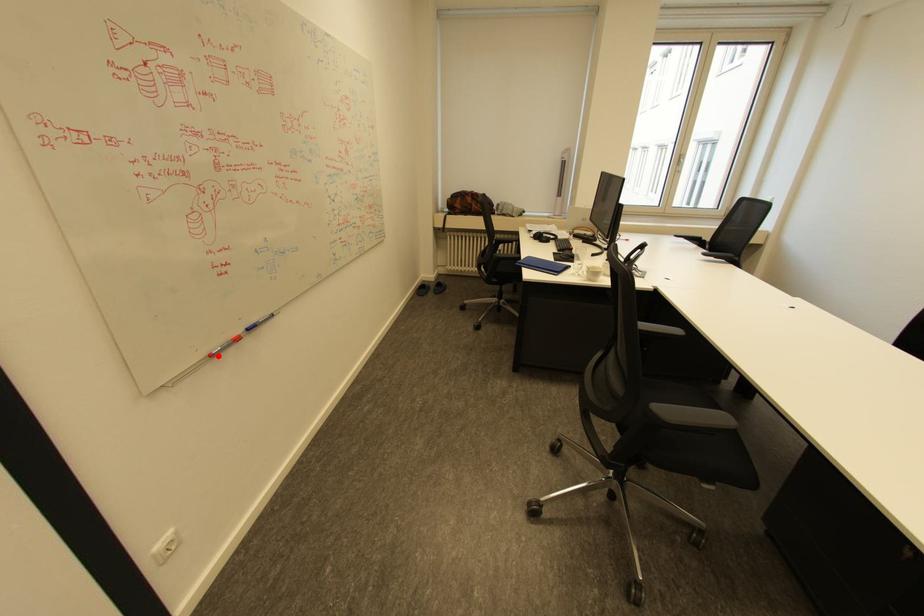
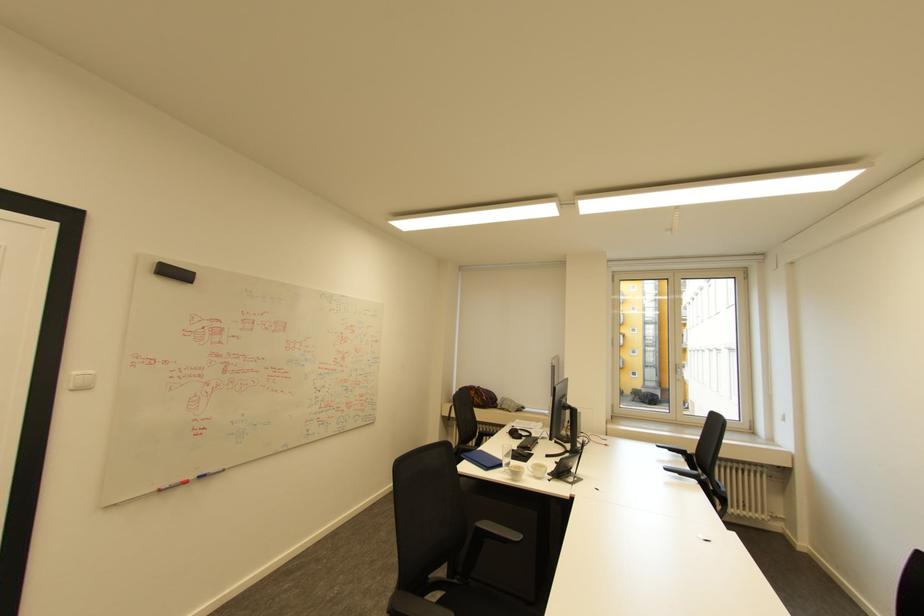
The point at the highlighted location is marked in the first image. Where is the corresponding point in the second image?

(165, 490)